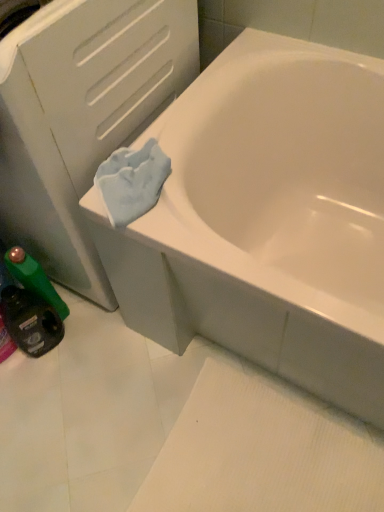
Question: Visually, is green plastic bottle at lower left, the 1th mouthwash in the top-to-bottom sequence, positioned to the left or to the right of green plastic mouthwash at lower left, the first mouthwash positioned from the bottom?

Choices:
 (A) right
 (B) left

Answer: (A)

Question: In terms of height, does green plastic bottle at lower left, the 1th mouthwash in the top-to-bottom sequence, look taller or shorter compared to green plastic mouthwash at lower left, the first mouthwash positioned from the bottom?

Choices:
 (A) short
 (B) tall

Answer: (B)

Question: Which object is the farthest from the green plastic mouthwash at lower left, the first mouthwash positioned from the bottom?

Choices:
 (A) white glossy bathtub at upper right
 (B) green plastic bottle at lower left, which is counted as the 2th mouthwash, starting from the bottom
 (C) white matte file cabinet at upper left

Answer: (A)

Question: Which of these objects is positioned closest to the white matte file cabinet at upper left?

Choices:
 (A) green plastic mouthwash at lower left, the first mouthwash positioned from the bottom
 (B) green plastic bottle at lower left, the 1th mouthwash in the top-to-bottom sequence
 (C) white glossy bathtub at upper right

Answer: (C)